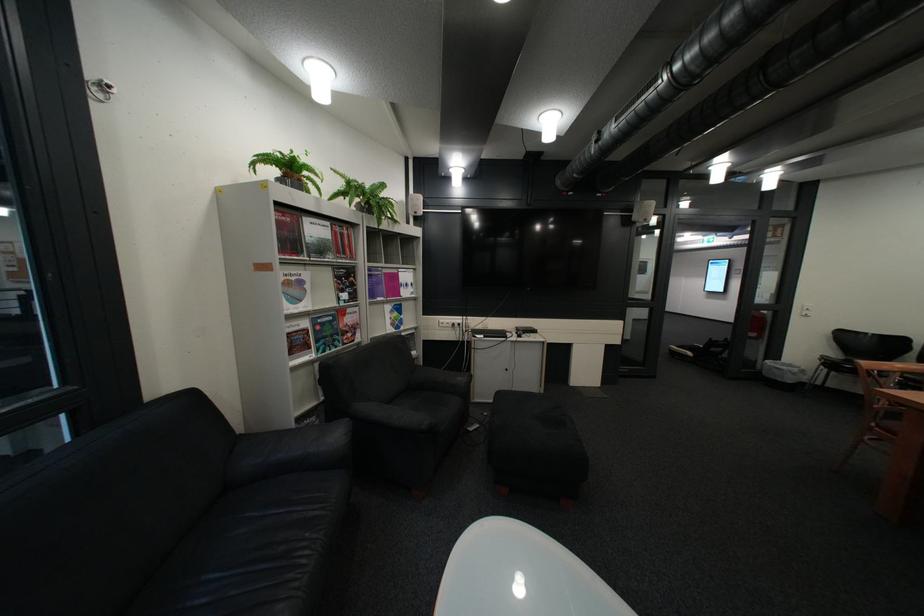
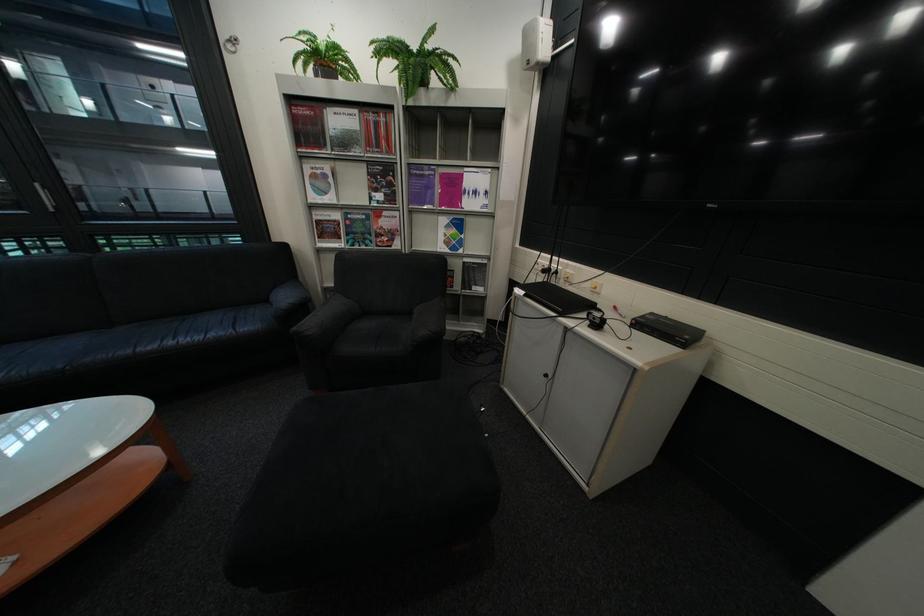
The point at (301, 284) is marked in the first image. Where is the corresponding point in the second image?

(329, 177)